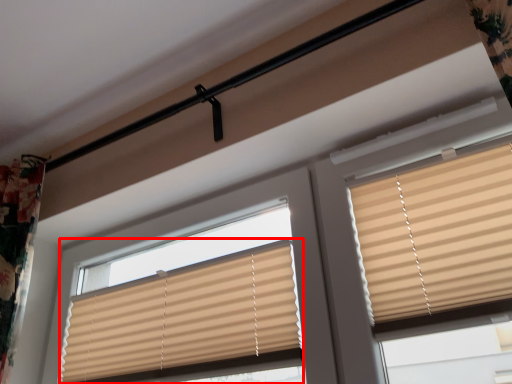
Question: From the image's perspective, where is window blind (annotated by the red box) located in relation to window blind in the image?

Choices:
 (A) below
 (B) above

Answer: (A)